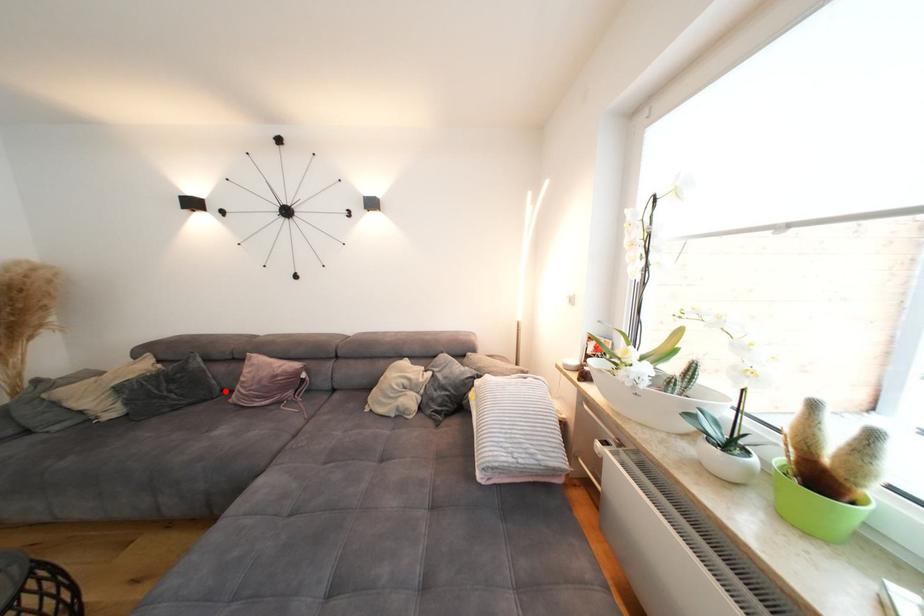
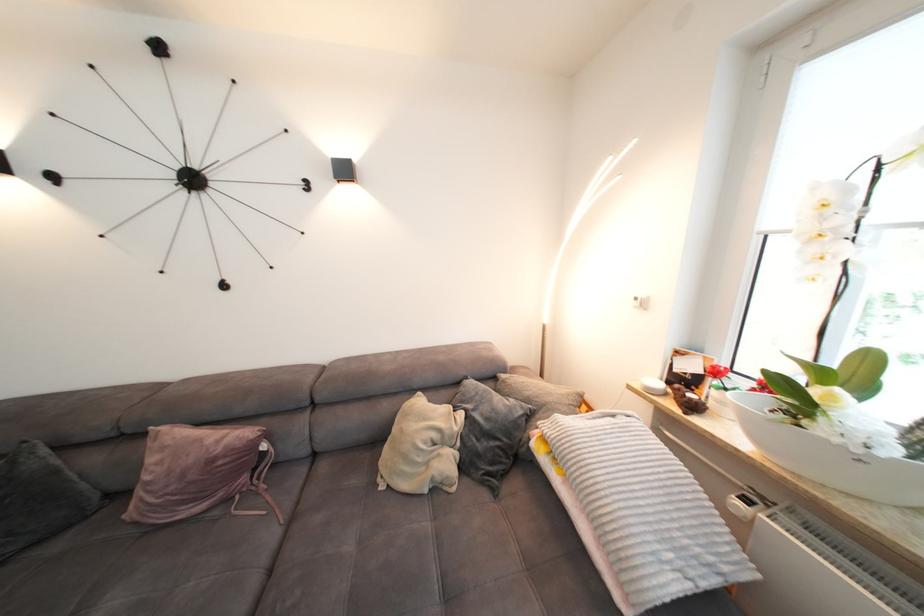
In the second image, find the point that corresponds to the highlighted location in the first image.

(103, 498)